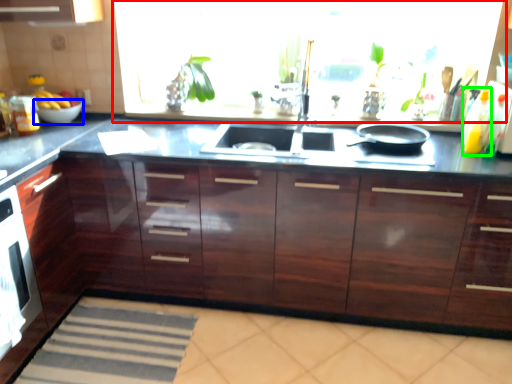
Question: Which object is the closest to the window screen (highlighted by a red box)? Choose among these: bowl (highlighted by a blue box) or bottle (highlighted by a green box).

Choices:
 (A) bowl
 (B) bottle

Answer: (B)